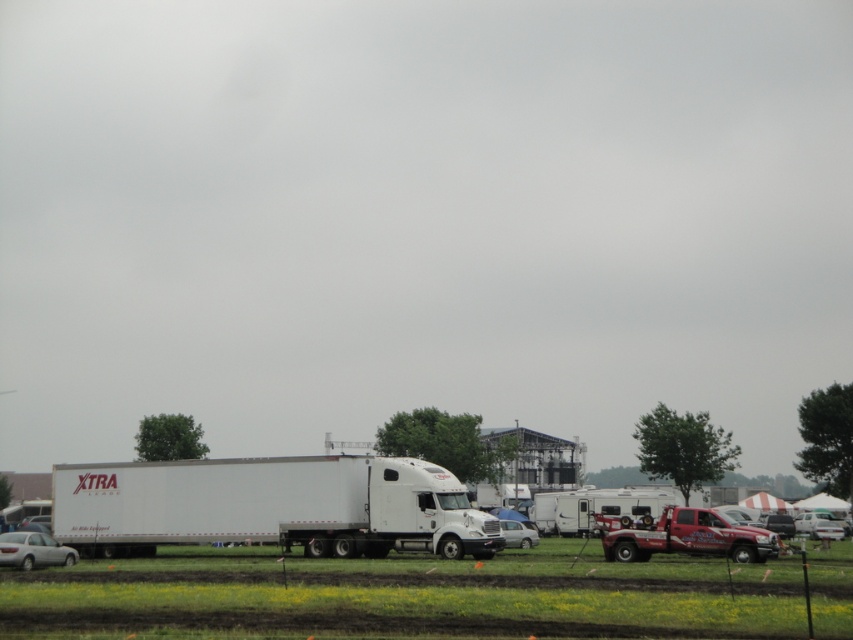
Does white matte trailer truck at center have a larger size compared to white glossy car at lower right?

Indeed, white matte trailer truck at center has a larger size compared to white glossy car at lower right.

Is point (180, 480) closer to viewer compared to point (811, 528)?

Yes, it is.

The height and width of the screenshot is (640, 853). What are the coordinates of `white matte trailer truck at center` in the screenshot? It's located at (270, 506).

I want to click on white glossy camper at center, so click(595, 508).

Looking at this image, can you confirm if white glossy camper at center is shorter than white glossy car at lower right?

In fact, white glossy camper at center may be taller than white glossy car at lower right.

Does point (566, 529) come farther from viewer compared to point (809, 531)?

No.

Where is `white glossy camper at center`? Image resolution: width=853 pixels, height=640 pixels. white glossy camper at center is located at coordinates (595, 508).

Is white glossy camper at center positioned before white matte sedan at lower left?

No, white glossy camper at center is behind white matte sedan at lower left.

Who is taller, white glossy camper at center or white matte sedan at lower left?

white glossy camper at center is taller.

Is point (641, 506) in front of point (33, 554)?

That is False.

Where is `white glossy camper at center`? Image resolution: width=853 pixels, height=640 pixels. white glossy camper at center is located at coordinates (595, 508).